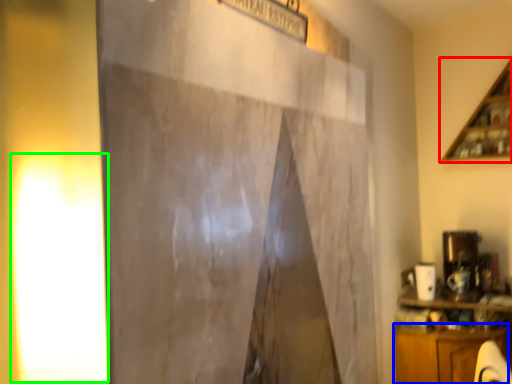
Question: Estimate the real-world distances between objects in this image. Which object is farther from shelf (highlighted by a red box), cabinetry (highlighted by a blue box) or light (highlighted by a green box)?

Choices:
 (A) cabinetry
 (B) light

Answer: (B)